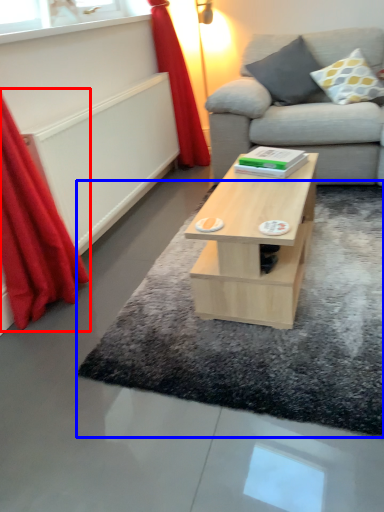
Question: Among these objects, which one is farthest to the camera, curtain (highlighted by a red box) or mat (highlighted by a blue box)?

Choices:
 (A) curtain
 (B) mat

Answer: (B)